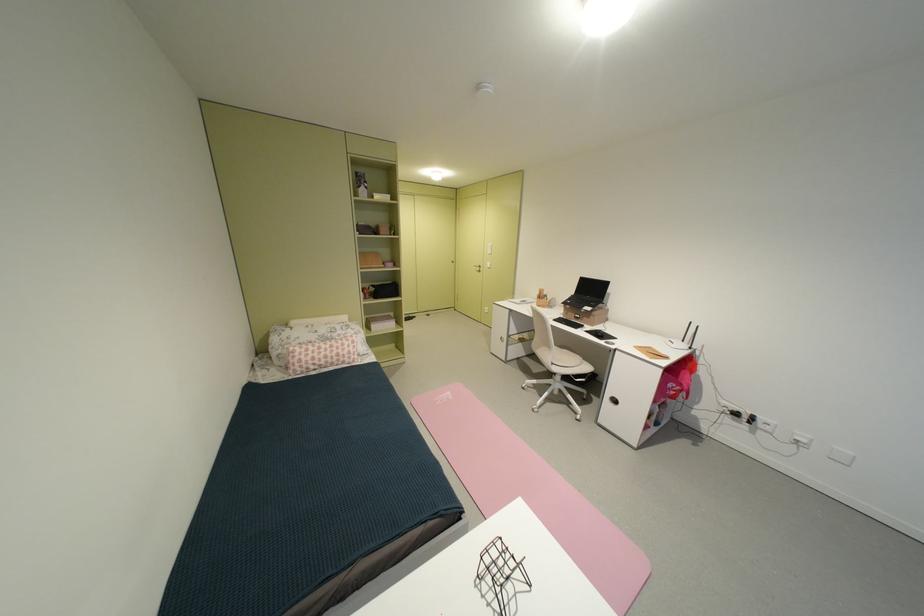
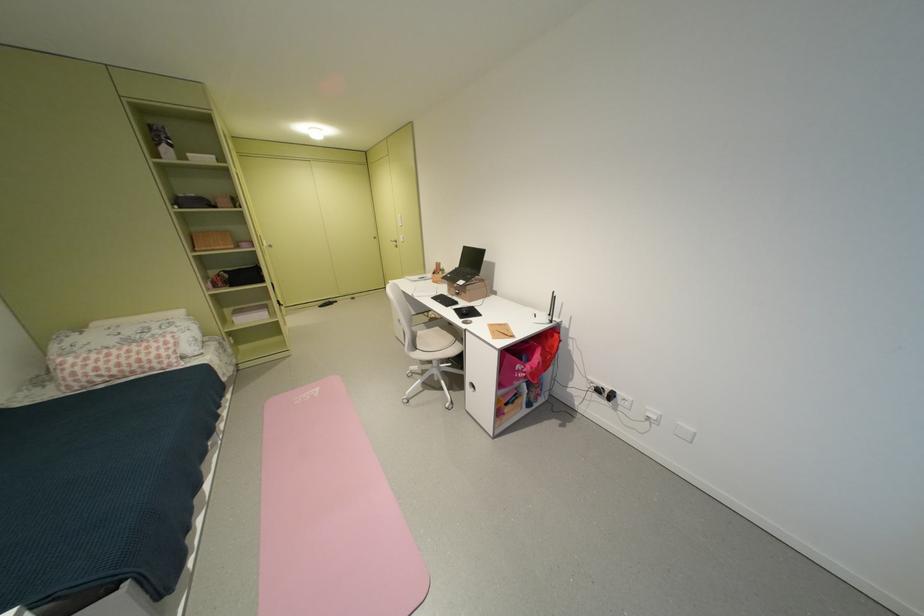
Locate, in the second image, the point that corresponds to point 563,363 in the first image.

(428, 349)